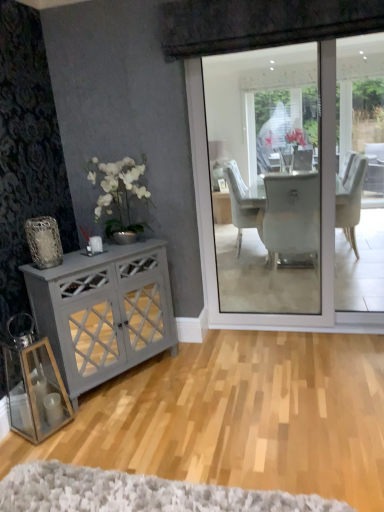
This screenshot has width=384, height=512. I want to click on free location to the right of matte gray cabinet at left, so click(x=201, y=382).